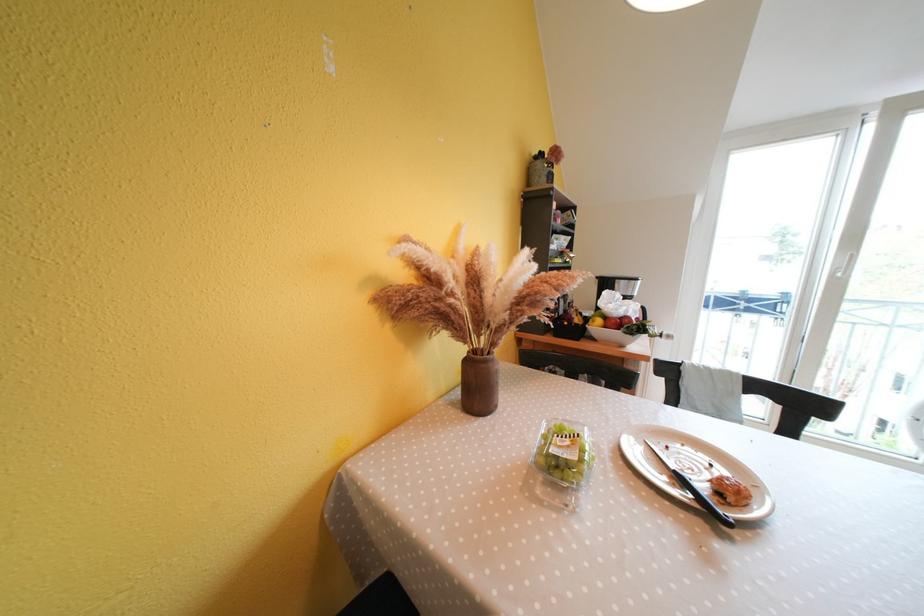
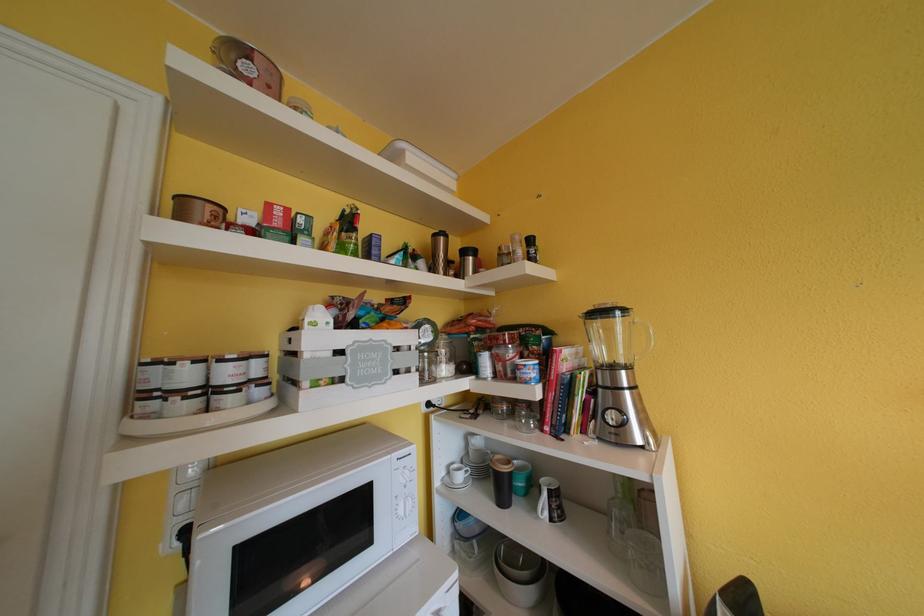
Question: The images are taken continuously from a first-person perspective. In which direction is your viewpoint rotating?

Choices:
 (A) Left
 (B) Right
 (C) Up
 (D) Down

Answer: (A)